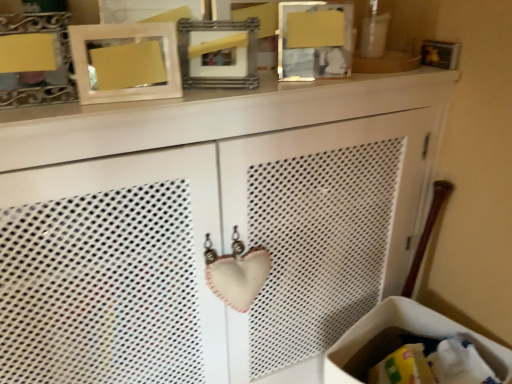
Locate an element on the screen. Image resolution: width=512 pixels, height=384 pixels. empty space that is to the right of matte white picture frame at upper center, the second picture frame positioned from the left is located at coordinates (199, 99).